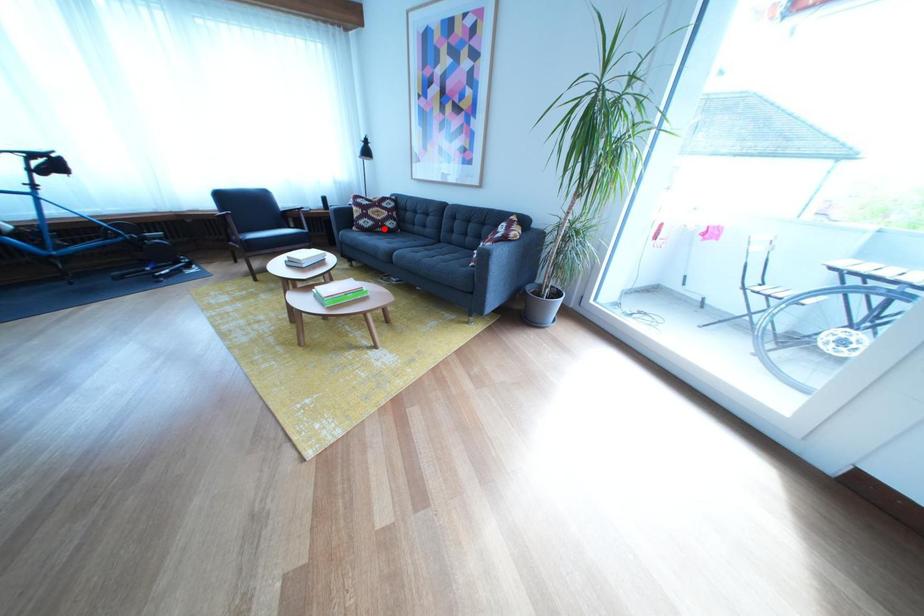
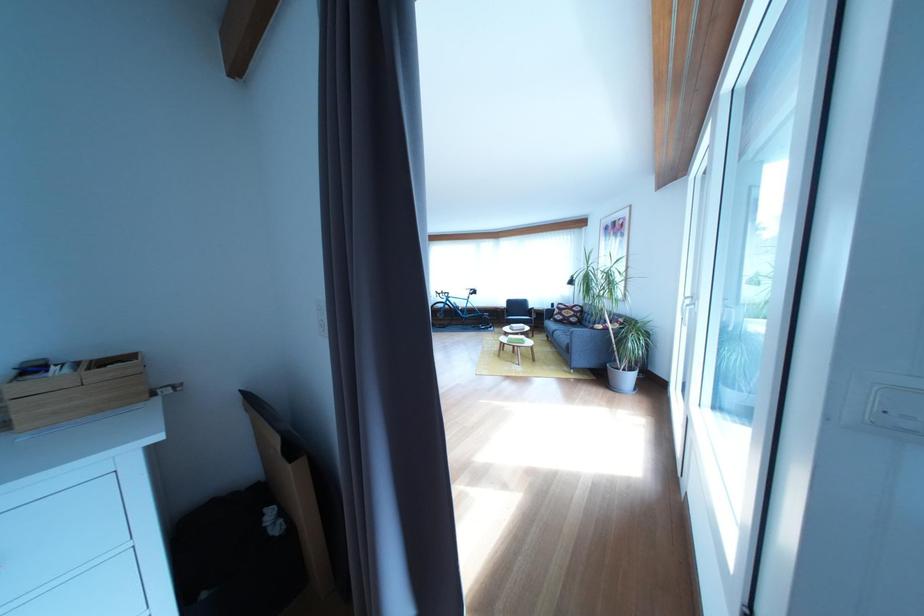
Question: A red point is marked in image1. In image2, is the corresponding 3D point closer to the camera or farther? Reply with the corresponding letter.

Choices:
 (A) The corresponding 3D point is closer.
 (B) The corresponding 3D point is farther.

Answer: (B)